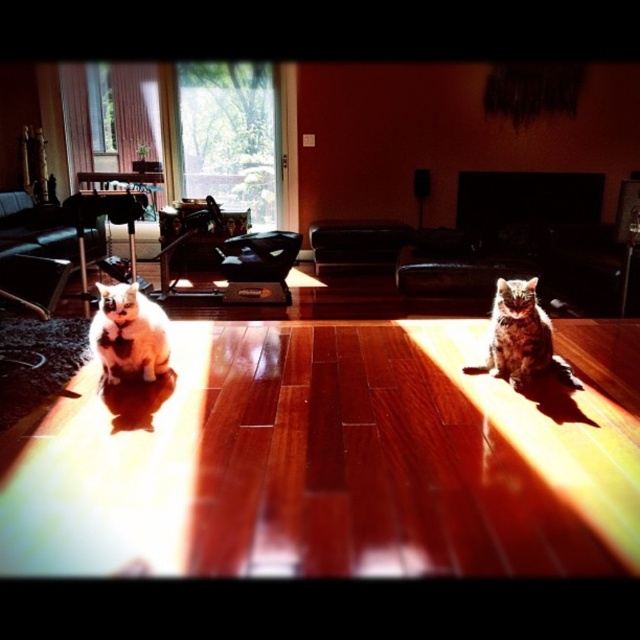
Question: Does white fluffy cat at left have a greater width compared to tabby fur cat at center?

Choices:
 (A) yes
 (B) no

Answer: (B)

Question: Observing the image, what is the correct spatial positioning of white fluffy cat at left in reference to tabby fur cat at center?

Choices:
 (A) left
 (B) right

Answer: (A)

Question: Which object is closer to the camera taking this photo?

Choices:
 (A) white fluffy cat at left
 (B) tabby fur cat at center

Answer: (A)

Question: Can you confirm if white fluffy cat at left is positioned below tabby fur cat at center?

Choices:
 (A) no
 (B) yes

Answer: (A)

Question: Which of the following is the farthest from the observer?

Choices:
 (A) (566, 372)
 (B) (120, 300)

Answer: (A)